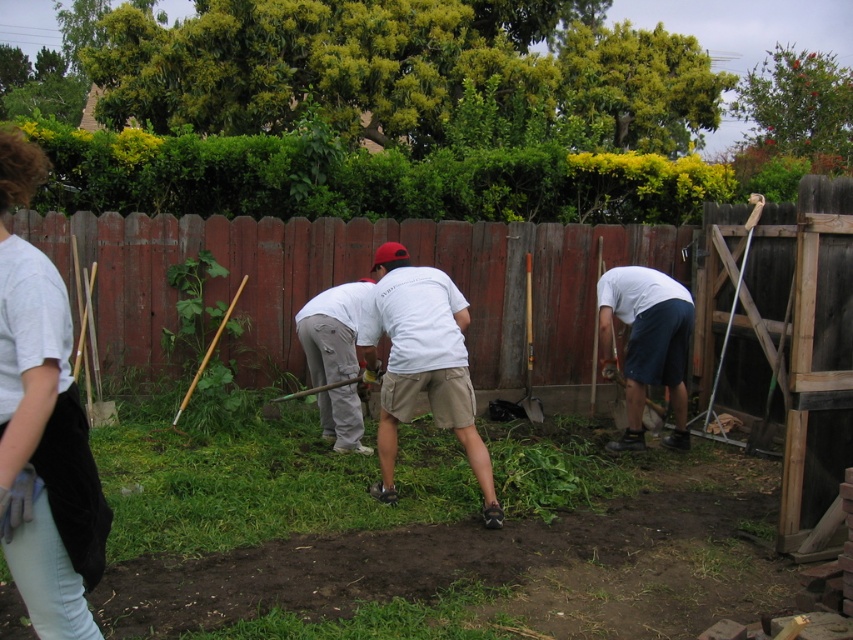
From the picture: In the gardening scene, you see two people wearing light blue jeans at lower left and white matte shorts at lower right. Which clothing item is positioned more to the left?

The light blue jeans at lower left are positioned more to the left than the white matte shorts at lower right.

You are planning to buy a new pair of shorts that are the same width as the white cotton shirt at center. Given that the white matte shorts at lower right are already too narrow for your comfort, will the new shorts be a better fit?

The white cotton shirt at center has a larger width than the white matte shorts at lower right. Since the shorts are too narrow, the new shorts with the same width as the shirt would likely be a better fit as they are wider.